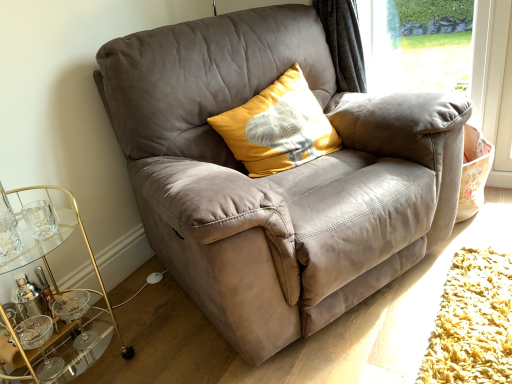
Question: Would you say suede gray chair at center is outside yellow textured cushion at center?

Choices:
 (A) yes
 (B) no

Answer: (A)

Question: Considering the relative positions of suede gray chair at center and yellow textured cushion at center in the image provided, is suede gray chair at center in front of yellow textured cushion at center?

Choices:
 (A) yes
 (B) no

Answer: (A)

Question: From the image's perspective, is suede gray chair at center beneath yellow textured cushion at center?

Choices:
 (A) no
 (B) yes

Answer: (B)

Question: Is suede gray chair at center taller than yellow textured cushion at center?

Choices:
 (A) yes
 (B) no

Answer: (A)

Question: Considering the relative sizes of suede gray chair at center and yellow textured cushion at center in the image provided, is suede gray chair at center bigger than yellow textured cushion at center?

Choices:
 (A) yes
 (B) no

Answer: (A)

Question: Is suede gray chair at center oriented towards yellow textured cushion at center?

Choices:
 (A) yes
 (B) no

Answer: (A)

Question: Does suede gray chair at center turn towards gold glass cocktail table at lower left?

Choices:
 (A) yes
 (B) no

Answer: (B)

Question: From a real-world perspective, is suede gray chair at center positioned under gold glass cocktail table at lower left based on gravity?

Choices:
 (A) yes
 (B) no

Answer: (B)

Question: Can you confirm if suede gray chair at center is taller than gold glass cocktail table at lower left?

Choices:
 (A) yes
 (B) no

Answer: (A)

Question: Does suede gray chair at center appear on the left side of gold glass cocktail table at lower left?

Choices:
 (A) no
 (B) yes

Answer: (A)

Question: From the image's perspective, would you say suede gray chair at center is positioned over gold glass cocktail table at lower left?

Choices:
 (A) yes
 (B) no

Answer: (A)

Question: Are suede gray chair at center and gold glass cocktail table at lower left far apart?

Choices:
 (A) no
 (B) yes

Answer: (A)

Question: Can you confirm if transparent glass window screen at upper right is taller than suede gray chair at center?

Choices:
 (A) yes
 (B) no

Answer: (B)